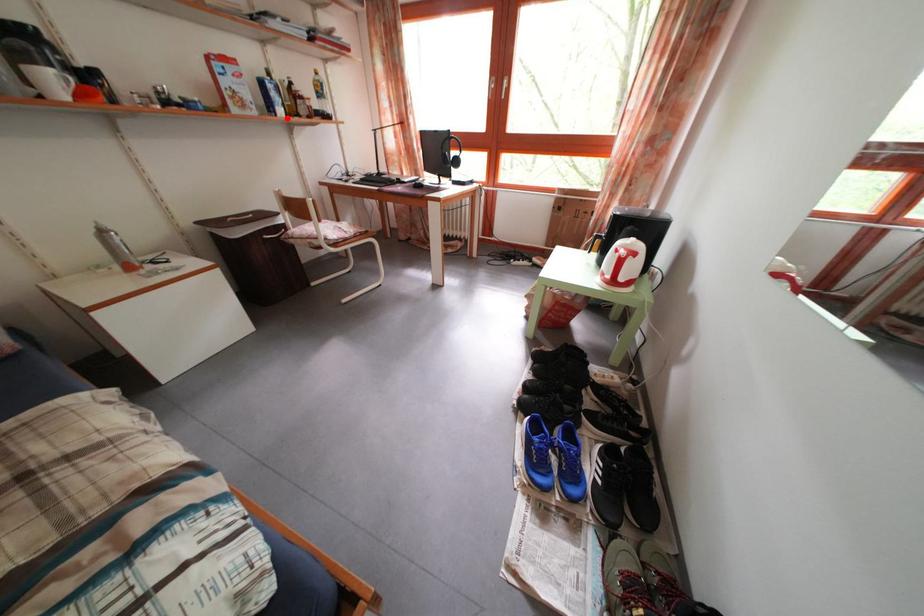
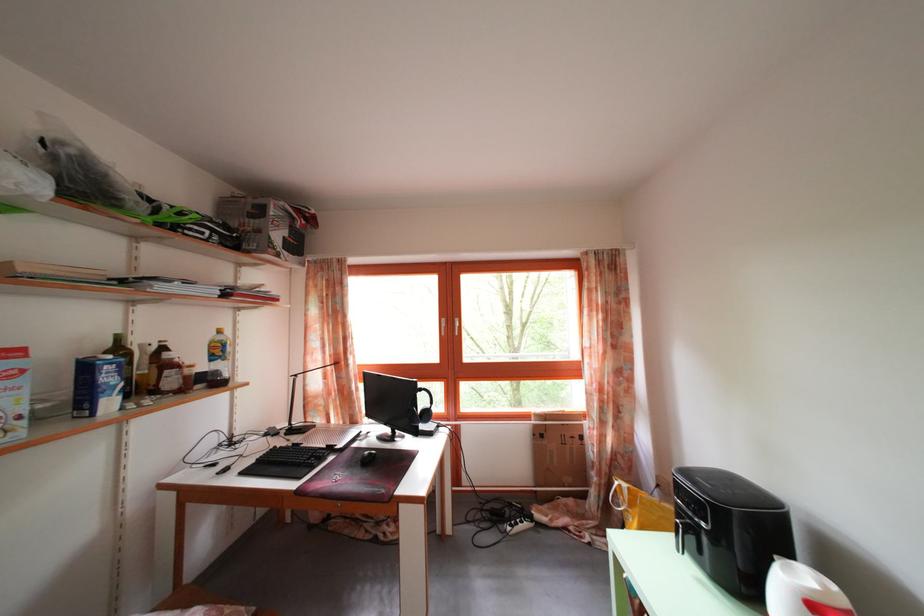
Where in the second image is the point corresponding to the highlighted location from the first image?

(117, 410)